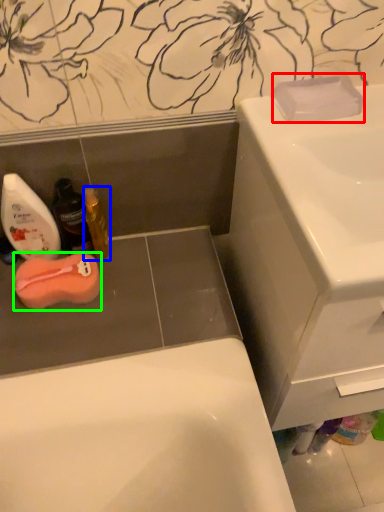
Question: Estimate the real-world distances between objects in this image. Which object is farther from soap (highlighted by a red box), mouthwash (highlighted by a blue box) or soap (highlighted by a green box)?

Choices:
 (A) mouthwash
 (B) soap

Answer: (B)